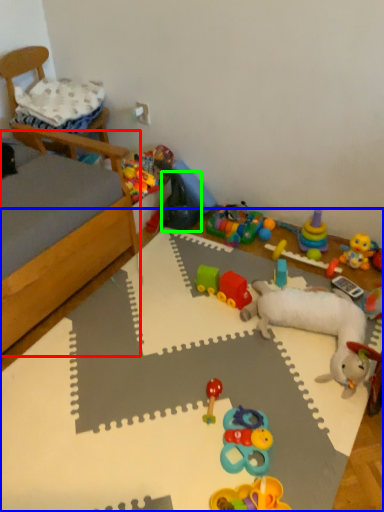
Question: Which object is the farthest from bed frame (highlighted by a red box)? Choose among these: table (highlighted by a blue box) or toy (highlighted by a green box).

Choices:
 (A) table
 (B) toy

Answer: (B)